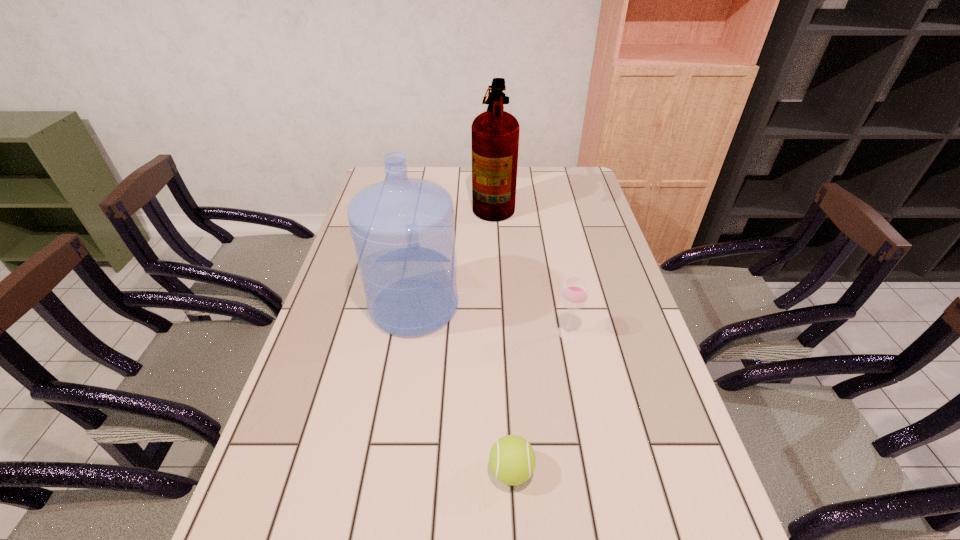
What are the coordinates of `vacant area between the tennis ball and the rightmost object` in the screenshot? It's located at (540, 402).

The width and height of the screenshot is (960, 540). I want to click on free spot between the leftmost object and the third tallest object, so click(x=491, y=319).

Find the location of a particular element. vacant area between the shortest object and the leftmost object is located at coordinates (463, 388).

Select which object appears as the third closest to the leftmost object. Please provide its 2D coordinates. Your answer should be formatted as a tuple, i.e. [(x, y)], where the tuple contains the x and y coordinates of a point satisfying the conditions above.

[(512, 460)]

Select which object is the closest to the farthest object. Please provide its 2D coordinates. Your answer should be formatted as a tuple, i.e. [(x, y)], where the tuple contains the x and y coordinates of a point satisfying the conditions above.

[(403, 229)]

This screenshot has height=540, width=960. Identify the location of vacant area that satisfies the following two spatial constraints: 1. on the back side of the nearest object; 2. at the nozzle of the farthest object. (496, 202).

The image size is (960, 540). Identify the location of free space in the image that satisfies the following two spatial constraints: 1. at the nozzle of the rightmost object; 2. on the right side of the farthest object. (499, 332).

Find the location of `blank area in the image that satisfies the following two spatial constraints: 1. at the nozzle of the tennis ball; 2. on the left side of the fire extinguisher`. blank area in the image that satisfies the following two spatial constraints: 1. at the nozzle of the tennis ball; 2. on the left side of the fire extinguisher is located at coordinates click(x=505, y=471).

The image size is (960, 540). I want to click on free space that satisfies the following two spatial constraints: 1. at the nozzle of the fire extinguisher; 2. on the right side of the shortest object, so click(505, 471).

Locate an element on the screen. vacant space that satisfies the following two spatial constraints: 1. on the back side of the third tallest object; 2. at the nozzle of the farthest object is located at coordinates (541, 202).